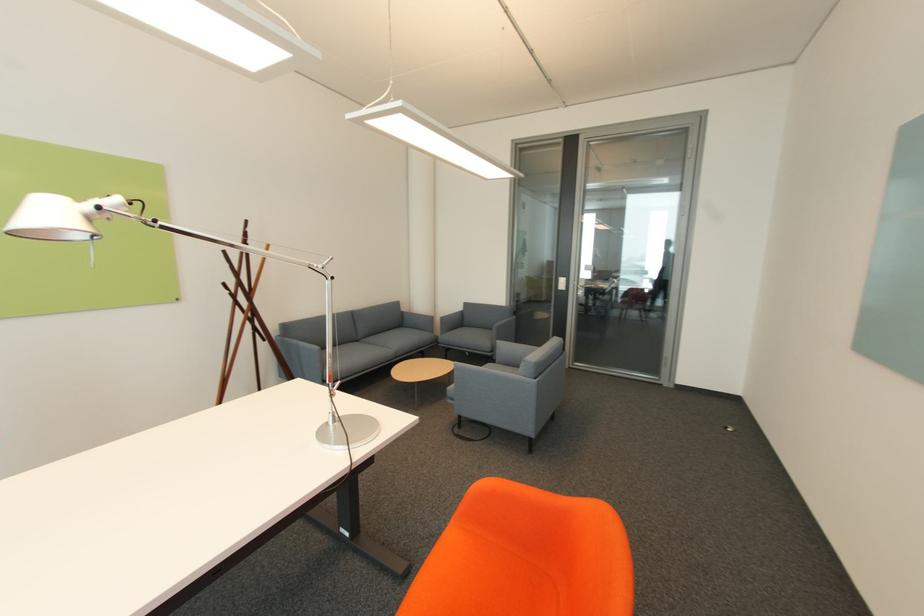
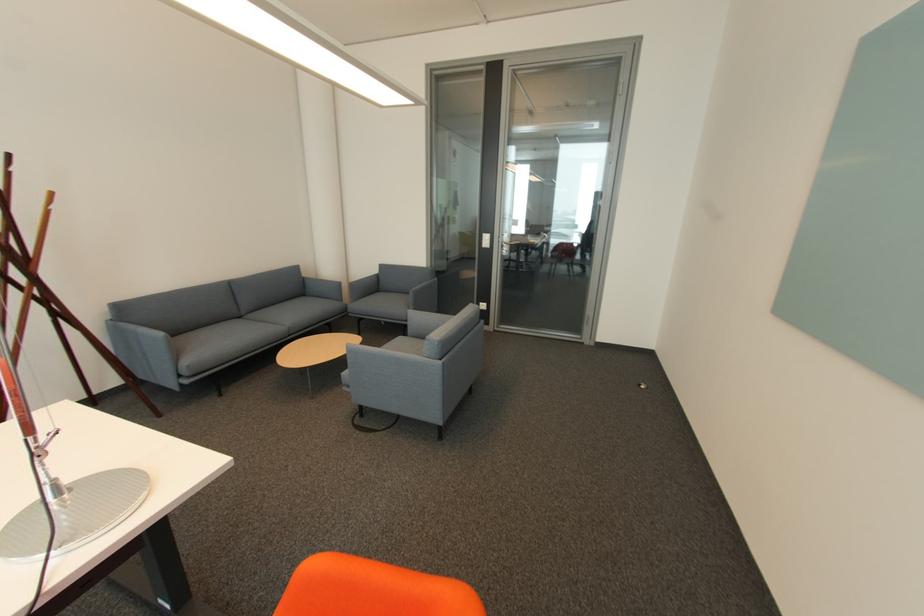
Where in the second image is the point corresponding to pixel 586 294 from the first image?

(508, 252)